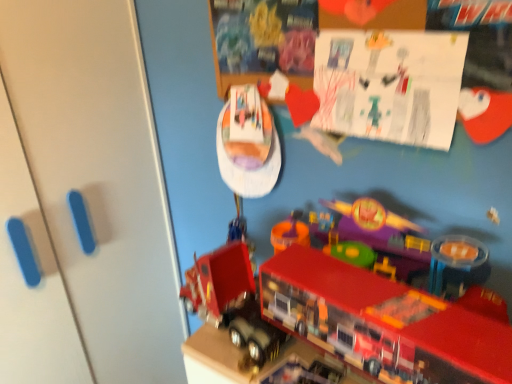
Question: Does white matte door at left come behind shiny plastic toy truck at lower center, positioned as the third toy in top-to-bottom order?

Choices:
 (A) yes
 (B) no

Answer: (B)

Question: From the image's perspective, is white matte door at left on top of shiny plastic toy truck at lower center, acting as the 1th toy starting from the bottom?

Choices:
 (A) no
 (B) yes

Answer: (B)

Question: Is white matte door at left shorter than shiny plastic toy truck at lower center, acting as the 1th toy starting from the bottom?

Choices:
 (A) yes
 (B) no

Answer: (B)

Question: Could you tell me if white matte door at left is facing shiny plastic toy truck at lower center, acting as the 1th toy starting from the bottom?

Choices:
 (A) yes
 (B) no

Answer: (A)

Question: Would you say white matte door at left is outside shiny plastic toy truck at lower center, acting as the 1th toy starting from the bottom?

Choices:
 (A) no
 (B) yes

Answer: (B)

Question: Is white matte door at left positioned far away from shiny plastic toy truck at lower center, positioned as the third toy in top-to-bottom order?

Choices:
 (A) yes
 (B) no

Answer: (B)

Question: Is shiny plastic toy boat at upper center, placed as the 3th toy when sorted from bottom to top, taller than white matte door at left?

Choices:
 (A) no
 (B) yes

Answer: (A)

Question: Can white matte door at left be found inside shiny plastic toy boat at upper center, placed as the 3th toy when sorted from bottom to top?

Choices:
 (A) yes
 (B) no

Answer: (B)

Question: Is shiny plastic toy boat at upper center, placed as the 3th toy when sorted from bottom to top, with white matte door at left?

Choices:
 (A) no
 (B) yes

Answer: (A)

Question: From a real-world perspective, is shiny plastic toy boat at upper center, placed as the 3th toy when sorted from bottom to top, beneath white matte door at left?

Choices:
 (A) no
 (B) yes

Answer: (A)

Question: From a real-world perspective, is shiny plastic toy boat at upper center, placed as the 3th toy when sorted from bottom to top, over white matte door at left?

Choices:
 (A) no
 (B) yes

Answer: (B)

Question: Considering the relative positions of shiny plastic toy boat at upper center, placed as the 3th toy when sorted from bottom to top, and white matte door at left in the image provided, is shiny plastic toy boat at upper center, placed as the 3th toy when sorted from bottom to top, to the right of white matte door at left from the viewer's perspective?

Choices:
 (A) yes
 (B) no

Answer: (A)

Question: From the image's perspective, is shiny plastic fire truck at lower right, marked as the second toy in a top-to-bottom arrangement, on white matte door at left?

Choices:
 (A) no
 (B) yes

Answer: (B)